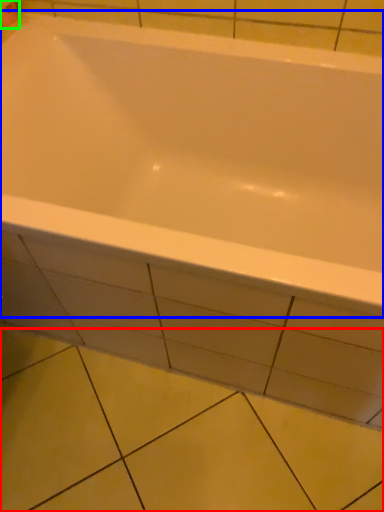
Question: Based on their relative distances, which object is farther from ceramic tile (highlighted by a red box)? Choose from bathtub (highlighted by a blue box) and toilet paper (highlighted by a green box).

Choices:
 (A) bathtub
 (B) toilet paper

Answer: (B)